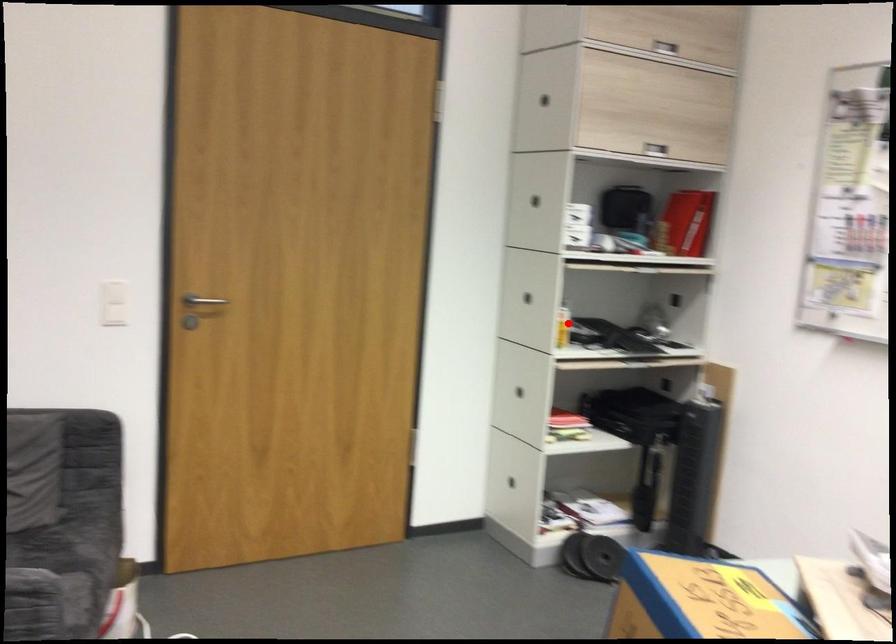
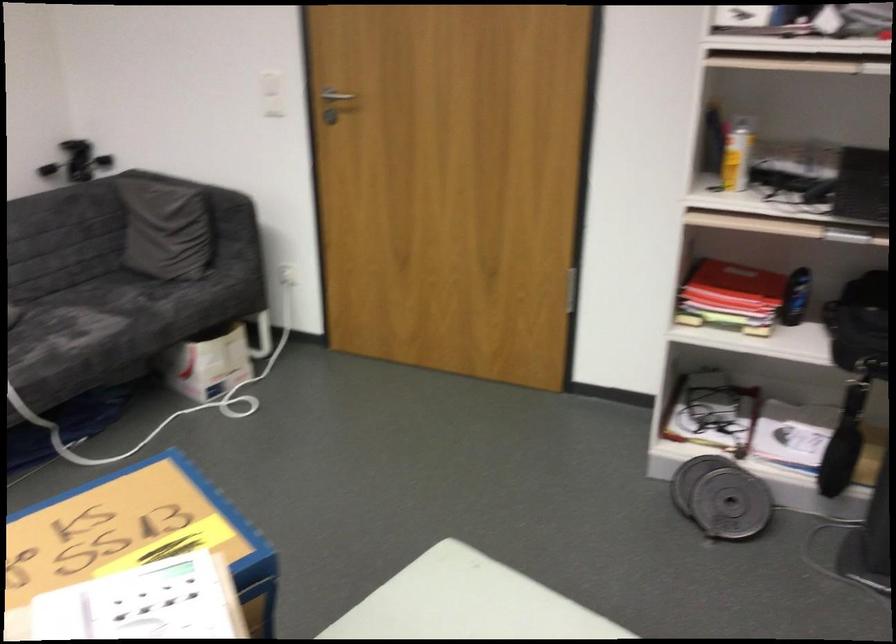
Question: I am providing you with two images of the same scene from different viewpoints. A red point is marked on the first image. Is the red point's position out of view in image 2?

Choices:
 (A) Yes
 (B) No

Answer: (B)